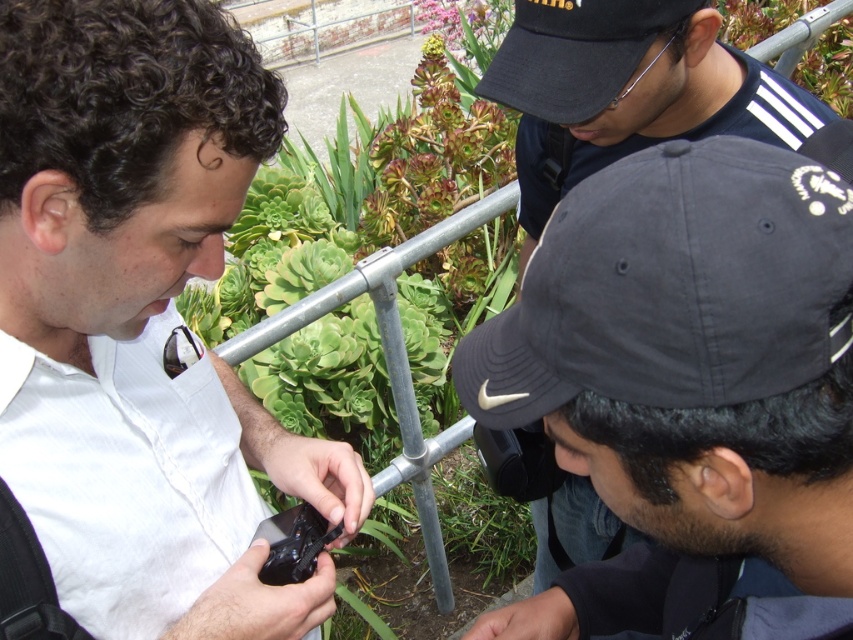
You are a GUI agent. You are given a task and a screenshot of the screen. Output one action in this format:
    pyautogui.click(x=<x>, y=<y>)
    Task: Click on the dark gray fabric baseball cap at center
    Image resolution: width=853 pixels, height=640 pixels.
    Given the screenshot: What is the action you would take?
    pyautogui.click(x=672, y=285)

What do you see at coordinates (672, 285) in the screenshot? The height and width of the screenshot is (640, 853). I see `dark gray fabric baseball cap at center` at bounding box center [672, 285].

Measure the distance between point (830, 227) and camera.

They are 16.82 inches apart.

I want to click on dark gray fabric baseball cap at center, so click(x=672, y=285).

Which is behind, point (621, 86) or point (293, 577)?

The point (621, 86) is behind.

Is point (505, 61) behind point (294, 534)?

That is True.

Identify the location of black matte baseball cap at upper right. This screenshot has width=853, height=640. (576, 52).

Is dark gray cap at center behind green succulent at center?

No, it is in front of green succulent at center.

This screenshot has width=853, height=640. I want to click on dark gray cap at center, so click(x=689, y=390).